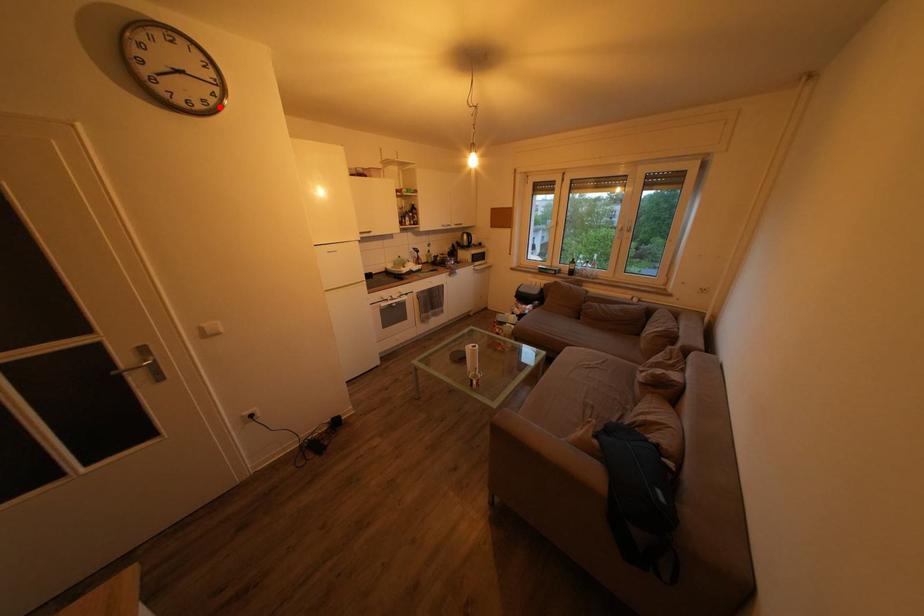
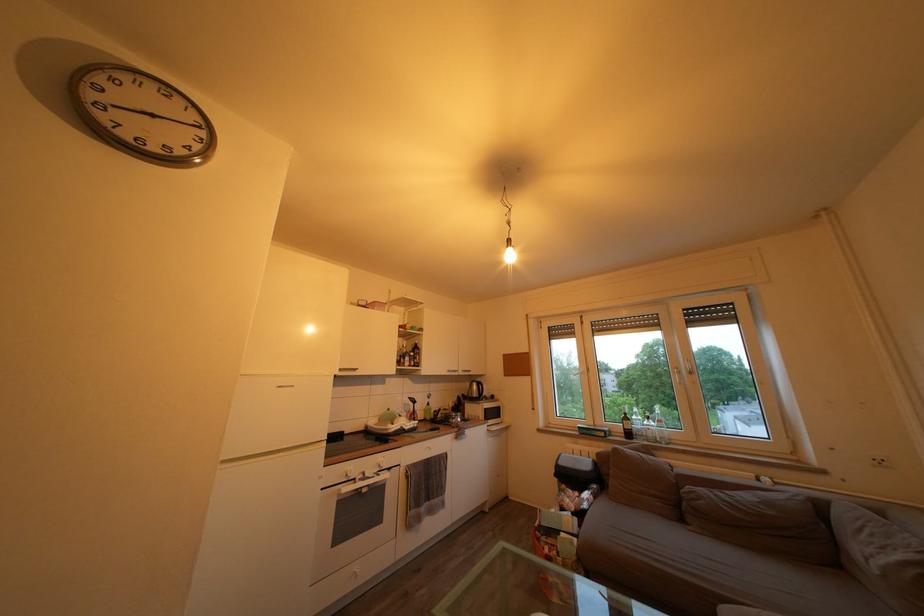
Locate, in the second image, the point that corresponds to the highlighted location in the first image.

(188, 158)